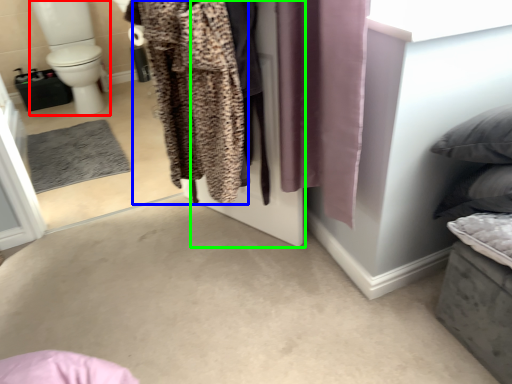
Question: Considering the real-world distances, which object is closest to toilet bowl (highlighted by a red box)? clothing (highlighted by a blue box) or screen door (highlighted by a green box).

Choices:
 (A) clothing
 (B) screen door

Answer: (B)